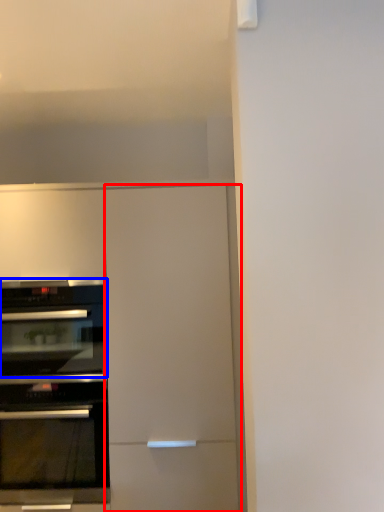
Question: Which of the following is the closest to the observer, door (highlighted by a red box) or oven (highlighted by a blue box)?

Choices:
 (A) door
 (B) oven

Answer: (A)